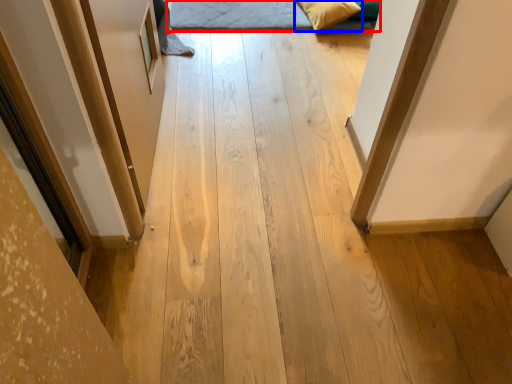
Question: Which point is further to the camera, bed (highlighted by a red box) or pillow (highlighted by a blue box)?

Choices:
 (A) bed
 (B) pillow

Answer: (A)